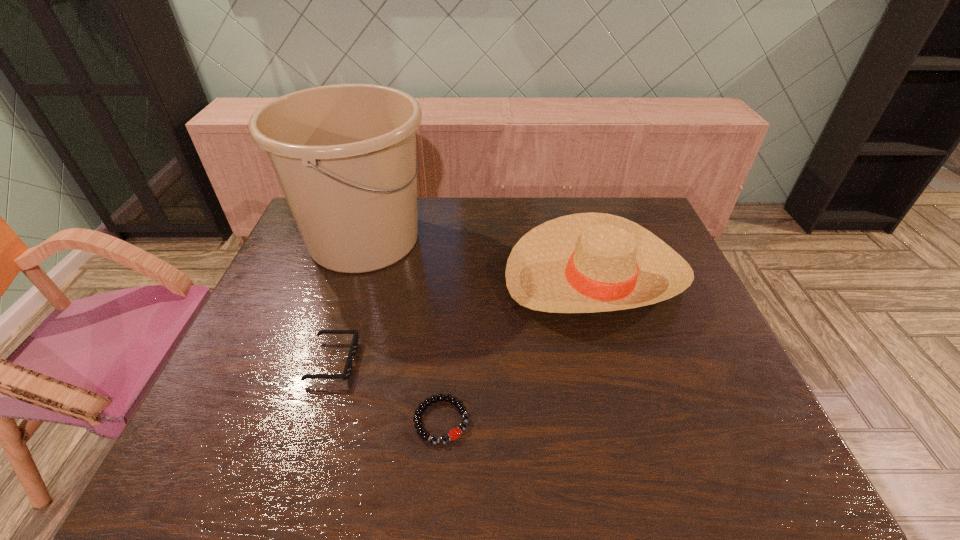
Where is `free spot located 0.350m on the back of the bracelet`? This screenshot has width=960, height=540. free spot located 0.350m on the back of the bracelet is located at coordinates (451, 291).

This screenshot has width=960, height=540. Find the location of `bucket that is positioned at the far edge`. bucket that is positioned at the far edge is located at coordinates (344, 155).

Image resolution: width=960 pixels, height=540 pixels. Identify the location of sunhat located in the far edge section of the desktop. (591, 262).

Find the location of a particular element. object at the near edge is located at coordinates (453, 434).

Image resolution: width=960 pixels, height=540 pixels. Identify the location of object that is at the left edge. (x=344, y=155).

Where is `object positioned at the right edge`? object positioned at the right edge is located at coordinates (591, 262).

Image resolution: width=960 pixels, height=540 pixels. Find the location of `object at the far left corner`. object at the far left corner is located at coordinates (344, 155).

Identify the location of object located at the far right corner. The width and height of the screenshot is (960, 540). (591, 262).

What are the coordinates of `free spot at the far edge of the desktop` in the screenshot? It's located at (456, 233).

This screenshot has width=960, height=540. Identify the location of free space at the near edge of the desktop. (681, 459).